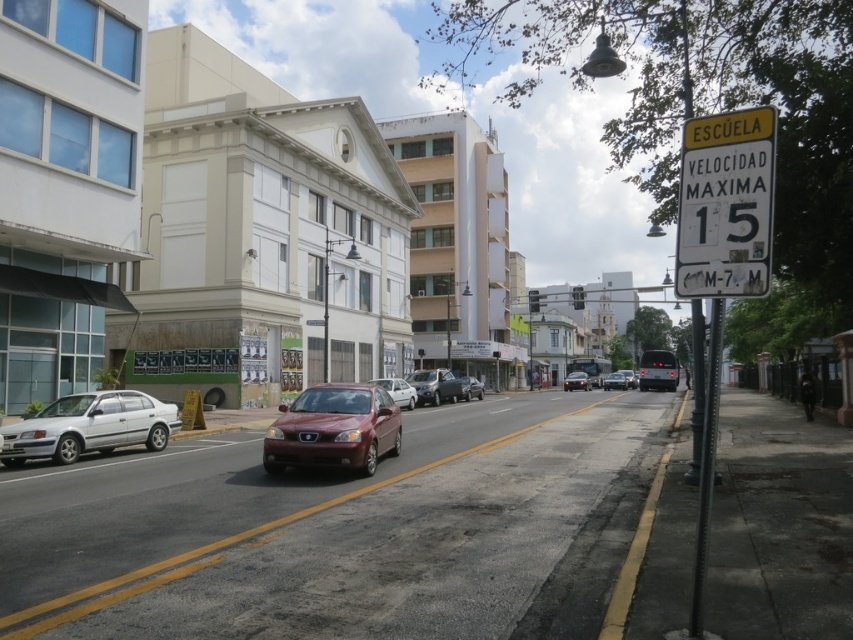
Between yellow metallic sign at upper right and white matte car at center, which one appears on the right side from the viewer's perspective?

From the viewer's perspective, yellow metallic sign at upper right appears more on the right side.

What do you see at coordinates (724, 204) in the screenshot?
I see `yellow metallic sign at upper right` at bounding box center [724, 204].

Locate an element on the screen. The image size is (853, 640). yellow metallic sign at upper right is located at coordinates (724, 204).

Between satin silver sedan at center and matte black sedan at center, which one has more height?

With more height is satin silver sedan at center.

Does satin silver sedan at center have a larger size compared to matte black sedan at center?

No.

Who is more forward, (434, 381) or (625, 381)?

Point (434, 381) is in front.

Locate an element on the screen. satin silver sedan at center is located at coordinates (434, 387).

Who is positioned more to the left, silver metallic sedan at left or matte black sedan at center?

Positioned to the left is silver metallic sedan at left.

Is point (103, 444) positioned behind point (625, 384)?

No.

Where is `silver metallic sedan at left`? The width and height of the screenshot is (853, 640). silver metallic sedan at left is located at coordinates (90, 426).